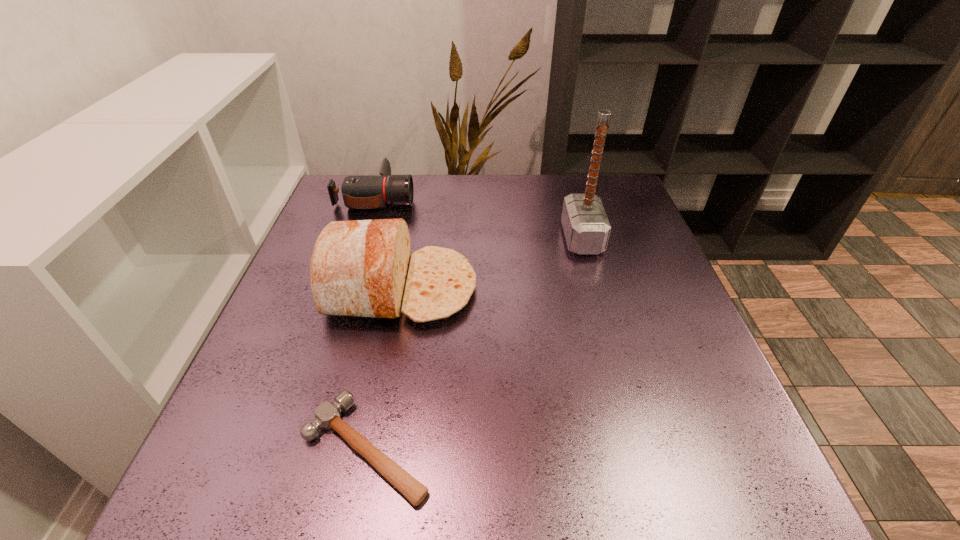
This screenshot has width=960, height=540. I want to click on object present at the near left corner, so click(327, 415).

Locate an element on the screen. The image size is (960, 540). vacant position at the far edge of the desktop is located at coordinates 498,205.

You are a GUI agent. You are given a task and a screenshot of the screen. Output one action in this format:
    pyautogui.click(x=<x>, y=<y>)
    Task: Click on the free space at the near edge of the desktop
    
    Given the screenshot: What is the action you would take?
    pyautogui.click(x=409, y=468)

In order to click on vacant space at the left edge in this screenshot , I will do `click(344, 336)`.

Where is `blank space at the right edge of the desktop`? blank space at the right edge of the desktop is located at coordinates [x=742, y=424].

Locate an element on the screen. vacant area at the near left corner of the desktop is located at coordinates (269, 460).

Where is `blank region between the farther hammer and the bread`? This screenshot has width=960, height=540. blank region between the farther hammer and the bread is located at coordinates (492, 264).

Find the location of a particular element. Image resolution: width=960 pixels, height=540 pixels. free space between the taller hammer and the farthest object is located at coordinates click(479, 218).

Identify the location of free space between the nearest object and the farther hammer. Image resolution: width=960 pixels, height=540 pixels. (474, 343).

Where is `unoccupied position between the right hammer and the second tallest object`? This screenshot has width=960, height=540. unoccupied position between the right hammer and the second tallest object is located at coordinates (492, 264).